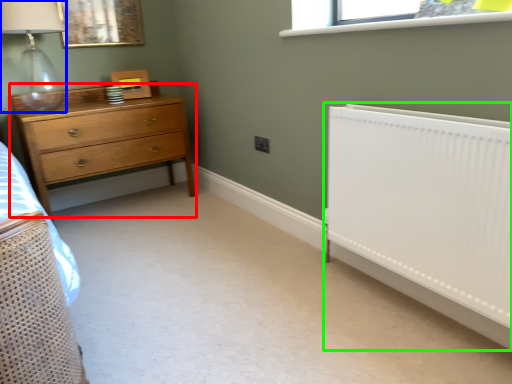
Question: Considering the real-world distances, which object is farthest from chest of drawers (highlighted by a red box)? lamp (highlighted by a blue box) or radiator (highlighted by a green box)?

Choices:
 (A) lamp
 (B) radiator

Answer: (B)